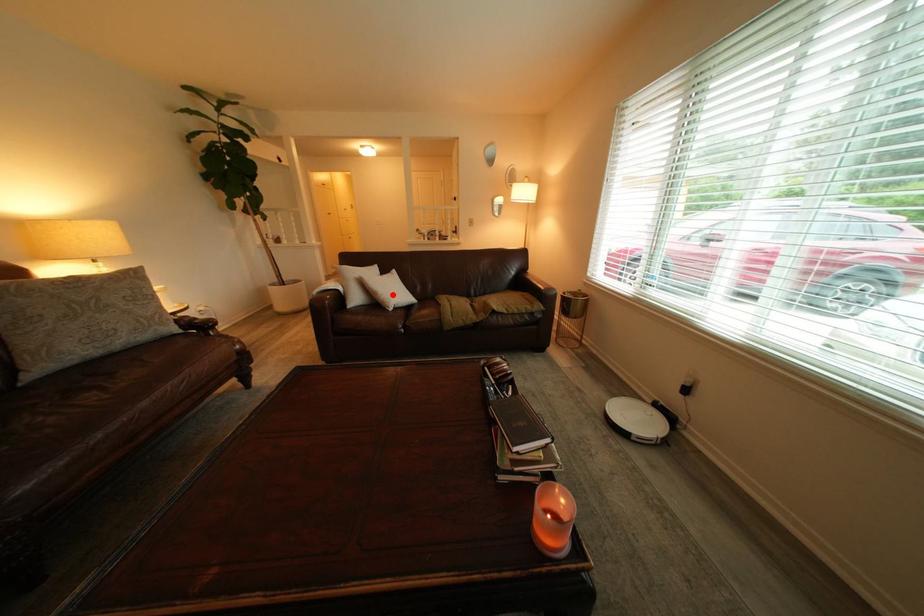
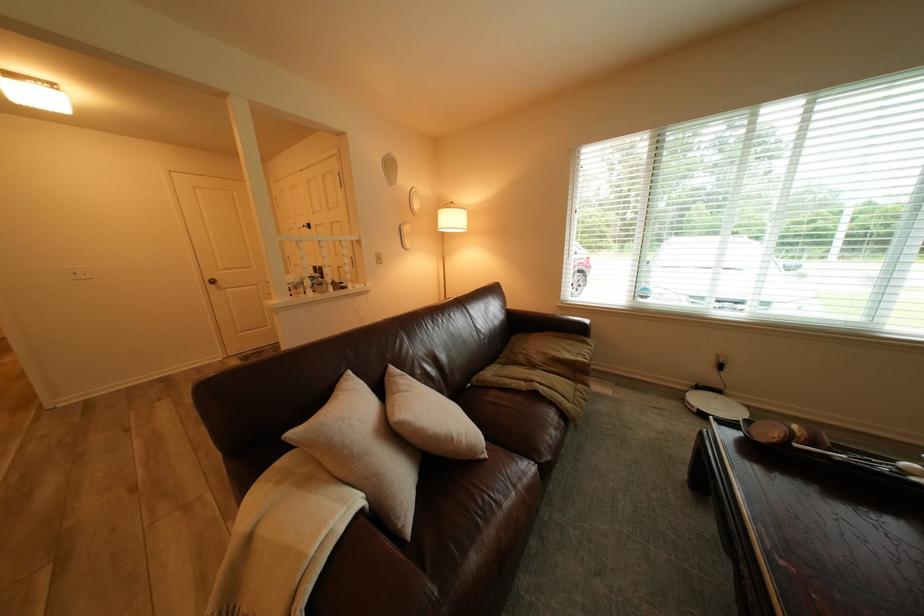
Find the pixel in the second image that matches the highlighted location in the first image.

(468, 438)